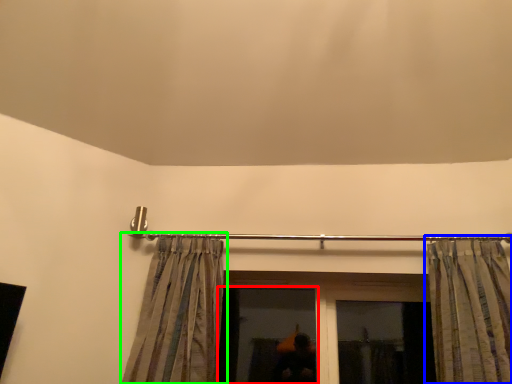
Question: Considering the real-world distances, which object is closest to window (highlighted by a red box)? curtain (highlighted by a blue box) or curtain (highlighted by a green box).

Choices:
 (A) curtain
 (B) curtain

Answer: (B)